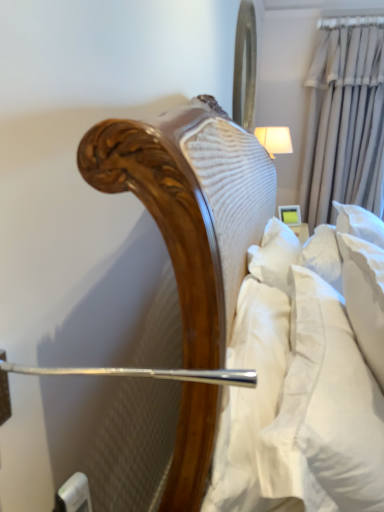
In order to face white soft pillow at right, should I rotate leftwards or rightwards?

To align with it, rotate right about 20.158°.

In order to face white fabric lampshade at upper right, should I rotate leftwards or rightwards?

Turn right approximately 10.538 degrees to face it.

The width and height of the screenshot is (384, 512). What are the coordinates of `metallic reflective mirror at upper center` in the screenshot? It's located at (245, 66).

I want to click on white soft pillow at right, so click(x=324, y=410).

How far apart are white soft pillow at right and beige fabric curtain at upper right?

white soft pillow at right and beige fabric curtain at upper right are 8.50 feet apart from each other.

Could you tell me if white soft pillow at right is turned towards beige fabric curtain at upper right?

No, white soft pillow at right is not turned towards beige fabric curtain at upper right.

Is white soft pillow at right wider than beige fabric curtain at upper right?

Incorrect, the width of white soft pillow at right does not surpass that of beige fabric curtain at upper right.

Visually, is white soft pillow at right positioned to the left or to the right of beige fabric curtain at upper right?

white soft pillow at right is to the left of beige fabric curtain at upper right.

In the image, is metallic reflective mirror at upper center on the left side or the right side of white fabric lampshade at upper right?

Based on their positions, metallic reflective mirror at upper center is located to the left of white fabric lampshade at upper right.

Which object is closer to the camera, metallic reflective mirror at upper center or white fabric lampshade at upper right?

metallic reflective mirror at upper center is in front.

Can you confirm if metallic reflective mirror at upper center is wider than white fabric lampshade at upper right?

In fact, metallic reflective mirror at upper center might be narrower than white fabric lampshade at upper right.

Is metallic reflective mirror at upper center aimed at white fabric lampshade at upper right?

No, metallic reflective mirror at upper center is not aimed at white fabric lampshade at upper right.

Is metallic reflective mirror at upper center directly adjacent to beige fabric curtain at upper right?

No.

From the image's perspective, is metallic reflective mirror at upper center above or below beige fabric curtain at upper right?

Based on their image positions, metallic reflective mirror at upper center is located above beige fabric curtain at upper right.

Considering the relative positions of metallic reflective mirror at upper center and beige fabric curtain at upper right in the image provided, is metallic reflective mirror at upper center to the left of beige fabric curtain at upper right from the viewer's perspective?

Yes, metallic reflective mirror at upper center is to the left of beige fabric curtain at upper right.

What's the angular difference between metallic reflective mirror at upper center and beige fabric curtain at upper right's facing directions?

They differ by 90.3 degrees in their facing directions.

Consider the image. Is white soft pillow at right to the left of white fabric lampshade at upper right from the viewer's perspective?

Yes, white soft pillow at right is to the left of white fabric lampshade at upper right.

Which is in front, white soft pillow at right or white fabric lampshade at upper right?

white soft pillow at right is in front.

Can you tell me how much white soft pillow at right and white fabric lampshade at upper right differ in facing direction?

1.16 degrees separate the facing orientations of white soft pillow at right and white fabric lampshade at upper right.

Is white fabric lampshade at upper right not near metallic reflective mirror at upper center?

No, there isn't a large distance between white fabric lampshade at upper right and metallic reflective mirror at upper center.

Between white fabric lampshade at upper right and metallic reflective mirror at upper center, which one is positioned in front?

metallic reflective mirror at upper center is closer to the camera.

Which of these two, white fabric lampshade at upper right or metallic reflective mirror at upper center, stands taller?

metallic reflective mirror at upper center is taller.

Image resolution: width=384 pixels, height=512 pixels. I want to click on mirror in front of the white fabric lampshade at upper right, so click(245, 66).

Is white fabric lampshade at upper right closer to the viewer compared to white soft pillow at right?

No.

From the image's perspective, is white fabric lampshade at upper right on top of white soft pillow at right?

Yes, from the image's perspective, white fabric lampshade at upper right is above white soft pillow at right.

Considering the sizes of objects white fabric lampshade at upper right and white soft pillow at right in the image provided, who is smaller, white fabric lampshade at upper right or white soft pillow at right?

Smaller between the two is white fabric lampshade at upper right.

Can you confirm if white fabric lampshade at upper right is wider than white soft pillow at right?

Indeed, white fabric lampshade at upper right has a greater width compared to white soft pillow at right.

From the image's perspective, which object appears higher, beige fabric curtain at upper right or white fabric lampshade at upper right?

beige fabric curtain at upper right, from the image's perspective.

Can we say beige fabric curtain at upper right lies outside white fabric lampshade at upper right?

That's correct, beige fabric curtain at upper right is outside of white fabric lampshade at upper right.

Is white fabric lampshade at upper right at the back of beige fabric curtain at upper right?

That's not correct — beige fabric curtain at upper right is not looking away from white fabric lampshade at upper right.

Is beige fabric curtain at upper right positioned in front of white fabric lampshade at upper right?

That is True.

Locate an element on the screen. The height and width of the screenshot is (512, 384). curtain located on the right of white soft pillow at right is located at coordinates (345, 123).

This screenshot has height=512, width=384. I want to click on bedside lamp below the metallic reflective mirror at upper center (from a real-world perspective), so click(x=275, y=139).

From the image, which object appears to be nearer to white soft pillow at right, beige fabric curtain at upper right or metallic reflective mirror at upper center?

beige fabric curtain at upper right lies closer to white soft pillow at right than the other object.

Estimate the real-world distances between objects in this image. Which object is further from white soft pillow at right, metallic reflective mirror at upper center or white fabric lampshade at upper right?

metallic reflective mirror at upper center.

Based on their spatial positions, is beige fabric curtain at upper right or white fabric lampshade at upper right further from white soft pillow at right?

Based on the image, beige fabric curtain at upper right appears to be further to white soft pillow at right.

Which object lies nearer to the anchor point beige fabric curtain at upper right, white fabric lampshade at upper right or metallic reflective mirror at upper center?

white fabric lampshade at upper right lies closer to beige fabric curtain at upper right than the other object.

Looking at the image, which one is located closer to metallic reflective mirror at upper center, white soft pillow at right or white fabric lampshade at upper right?

white fabric lampshade at upper right.

Estimate the real-world distances between objects in this image. Which object is further from white soft pillow at right, white fabric lampshade at upper right or beige fabric curtain at upper right?

The object further to white soft pillow at right is beige fabric curtain at upper right.

From the image, which object appears to be farther from white fabric lampshade at upper right, white soft pillow at right or metallic reflective mirror at upper center?

white soft pillow at right is positioned further to the anchor white fabric lampshade at upper right.

Based on their spatial positions, is white fabric lampshade at upper right or metallic reflective mirror at upper center closer to white soft pillow at right?

The object closer to white soft pillow at right is white fabric lampshade at upper right.

I want to click on mirror between white soft pillow at right and beige fabric curtain at upper right along the z-axis, so click(x=245, y=66).

Locate an element on the screen. bedside lamp between metallic reflective mirror at upper center and beige fabric curtain at upper right is located at coordinates (275, 139).

Find the location of `curtain located between white soft pillow at right and white fabric lampshade at upper right in the depth direction`. curtain located between white soft pillow at right and white fabric lampshade at upper right in the depth direction is located at coordinates 345,123.

The height and width of the screenshot is (512, 384). What are the coordinates of `mirror between white soft pillow at right and white fabric lampshade at upper right from front to back` in the screenshot? It's located at pos(245,66).